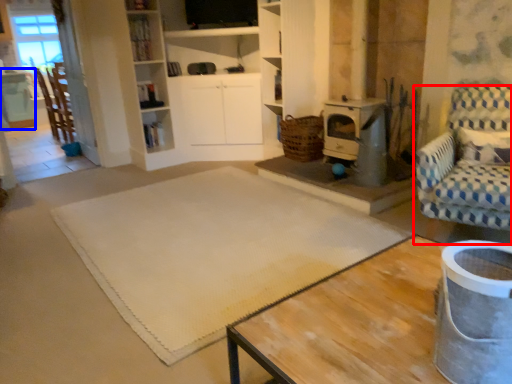
Question: Which object is closer to the camera taking this photo, chair (highlighted by a red box) or table (highlighted by a blue box)?

Choices:
 (A) chair
 (B) table

Answer: (A)